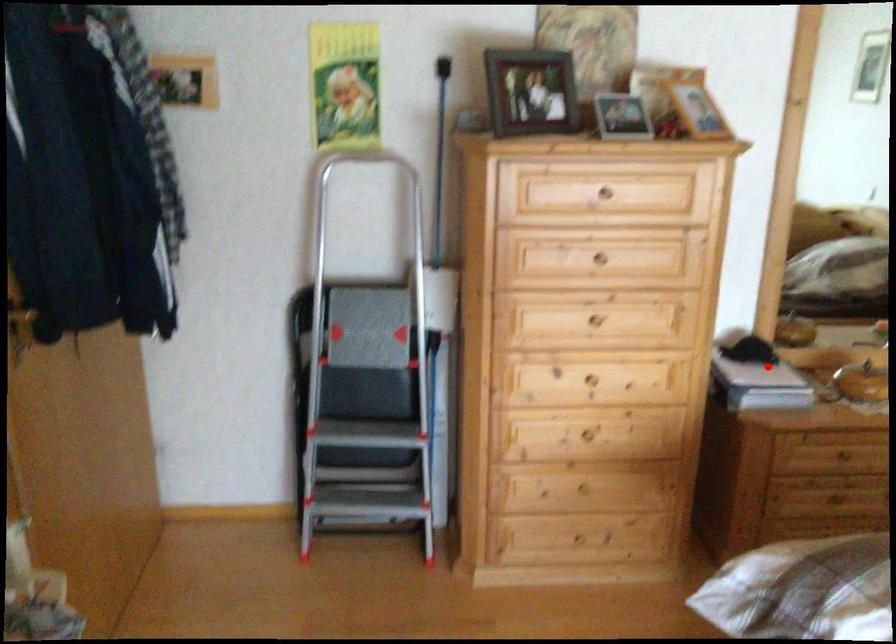
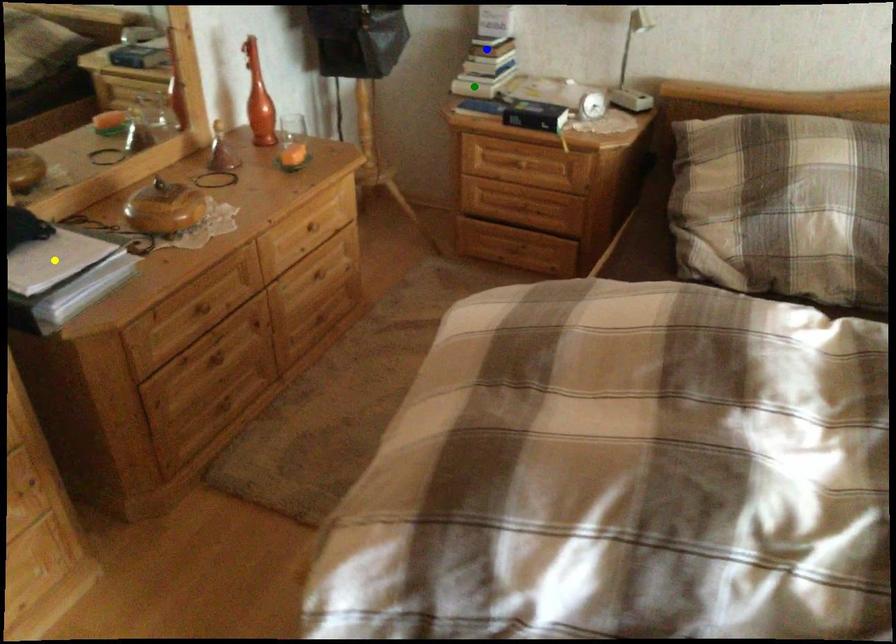
Question: I am providing you with two images of the same scene from different viewpoints. A red point is marked on the first image. You are given multiple points on the second image. Which spot in image 2 lines up with the point in image 1?

Choices:
 (A) yellow point
 (B) blue point
 (C) green point

Answer: (A)